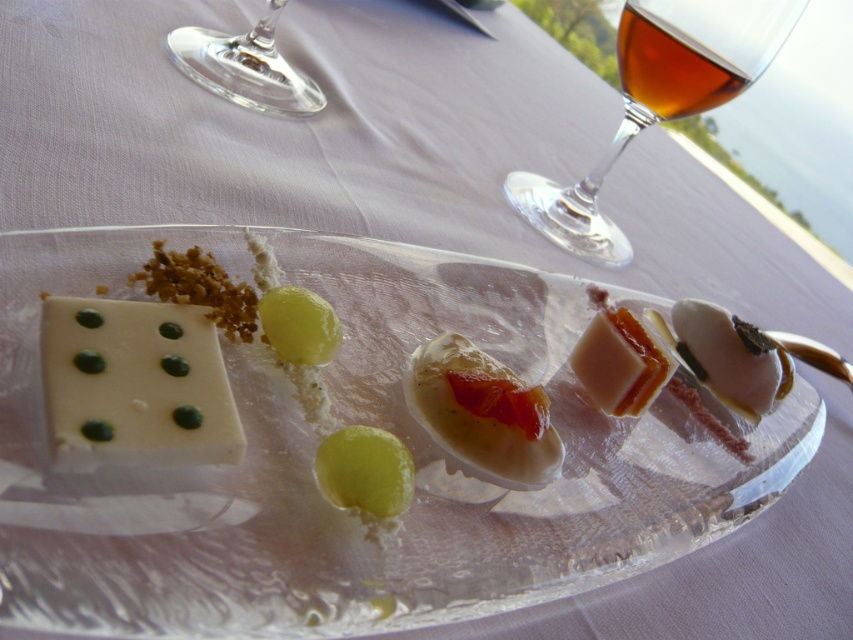
Question: Estimate the real-world distances between objects in this image. Which object is farther from the amber liquid glass at upper right?

Choices:
 (A) white glossy platter at center
 (B) white creamy cheese at lower left

Answer: (B)

Question: Which is farther from the transparent glass at upper left?

Choices:
 (A) white creamy cheese at upper right
 (B) translucent gelatin cube at center
 (C) amber liquid glass at upper right

Answer: (A)

Question: Which object is closer to the camera taking this photo?

Choices:
 (A) white glossy platter at center
 (B) amber liquid glass at upper right
 (C) amber glass at upper right

Answer: (A)

Question: Is white creamy cheese at lower left wider than amber glass at upper right?

Choices:
 (A) yes
 (B) no

Answer: (B)

Question: Is the position of amber liquid glass at upper right less distant than that of green translucent grape at center?

Choices:
 (A) yes
 (B) no

Answer: (B)

Question: Does amber liquid glass at upper right have a larger size compared to white creamy cheese at upper right?

Choices:
 (A) yes
 (B) no

Answer: (A)